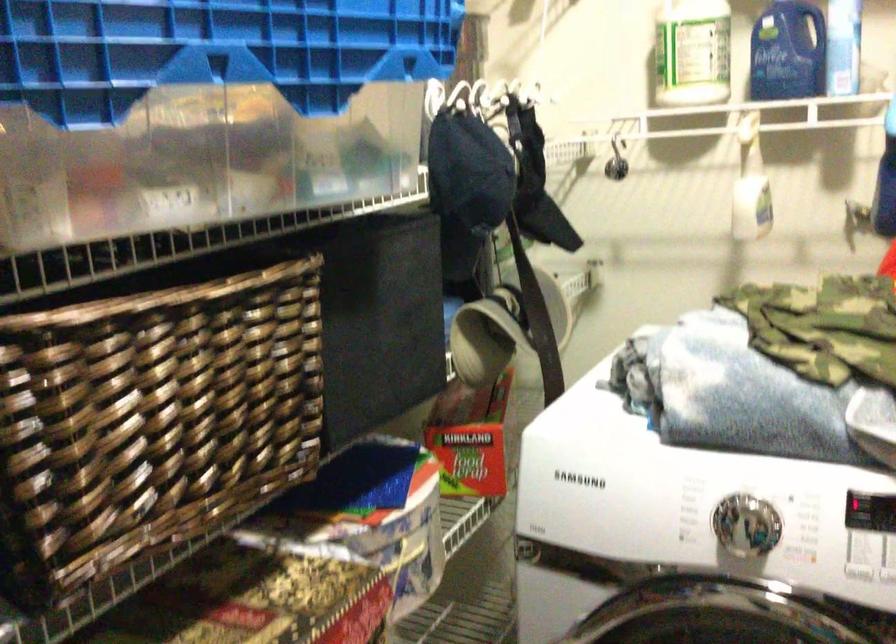
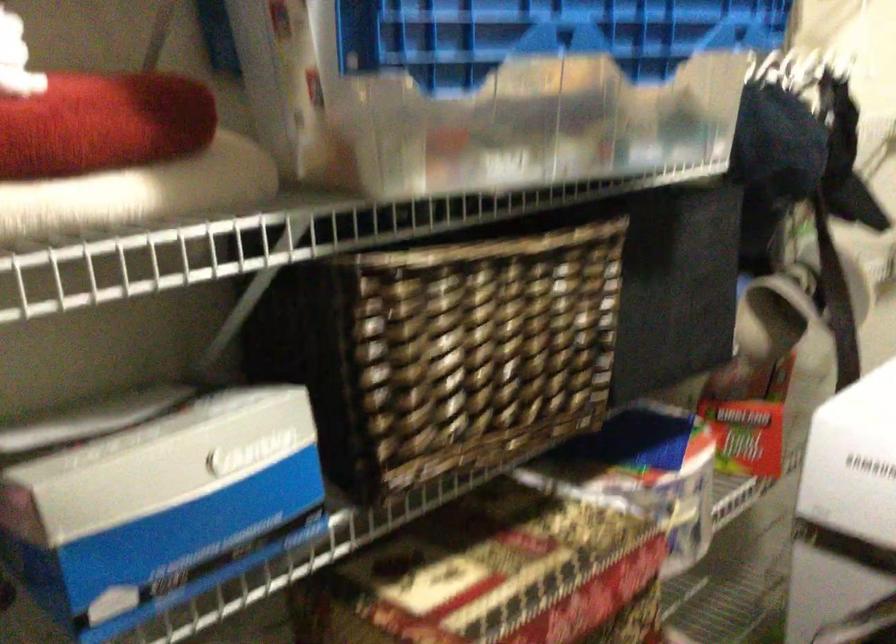
The images are taken continuously from a first-person perspective. In which direction are you moving?

The cameraman walked toward left, backward.